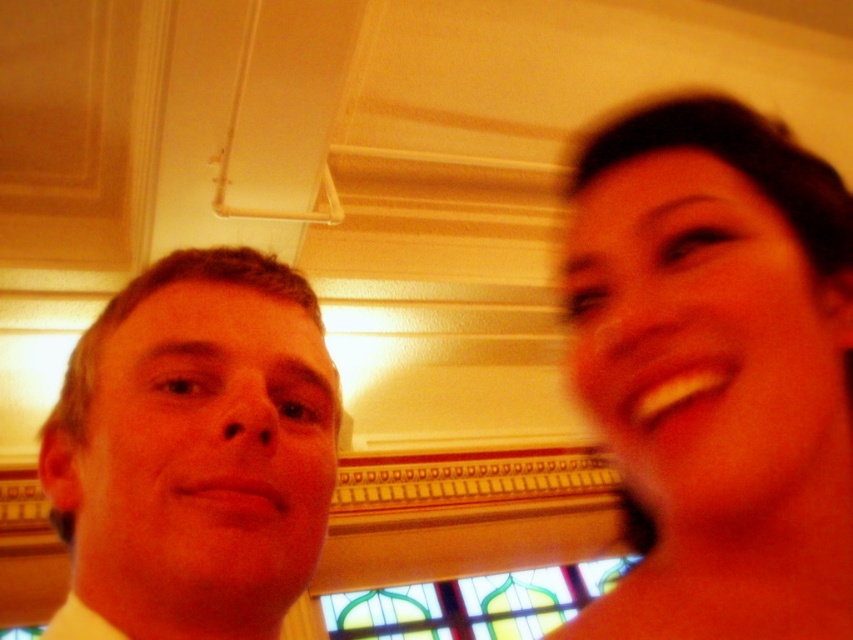
Question: Which point appears farthest from the camera in this image?

Choices:
 (A) (399, 636)
 (B) (84, 634)
 (C) (616, 266)

Answer: (A)

Question: Is smooth skin at right thinner than white cotton dress shirt at left?

Choices:
 (A) yes
 (B) no

Answer: (B)

Question: Considering the relative positions of smooth skin at right and matte yellow shirt at left in the image provided, where is smooth skin at right located with respect to matte yellow shirt at left?

Choices:
 (A) below
 (B) above

Answer: (B)

Question: Which object appears farthest from the camera in this image?

Choices:
 (A) matte yellow shirt at left
 (B) stained glass at center
 (C) white cotton dress shirt at left
 (D) smooth skin at right

Answer: (B)

Question: Does smooth skin at right appear over stained glass at center?

Choices:
 (A) yes
 (B) no

Answer: (A)

Question: Which point is farther from the camera taking this photo?

Choices:
 (A) (238, 520)
 (B) (453, 637)

Answer: (B)